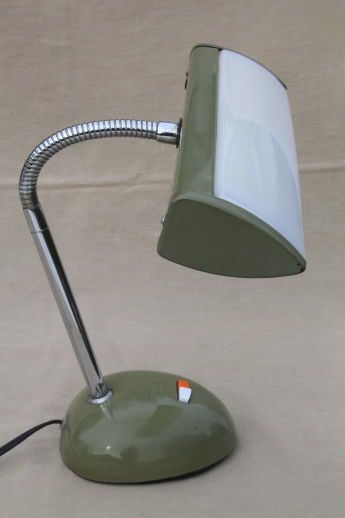
This screenshot has width=345, height=518. Identify the location of counter. (262, 376).